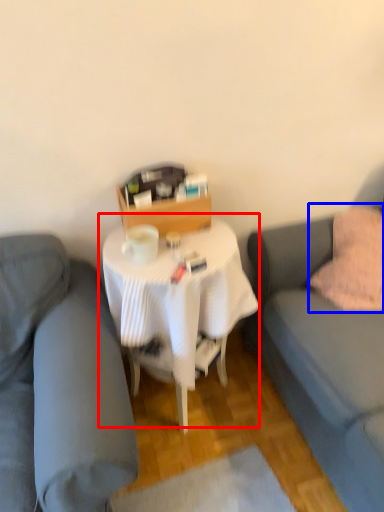
Question: Which point is further to the camera, table (highlighted by a red box) or throw pillow (highlighted by a blue box)?

Choices:
 (A) table
 (B) throw pillow

Answer: (B)